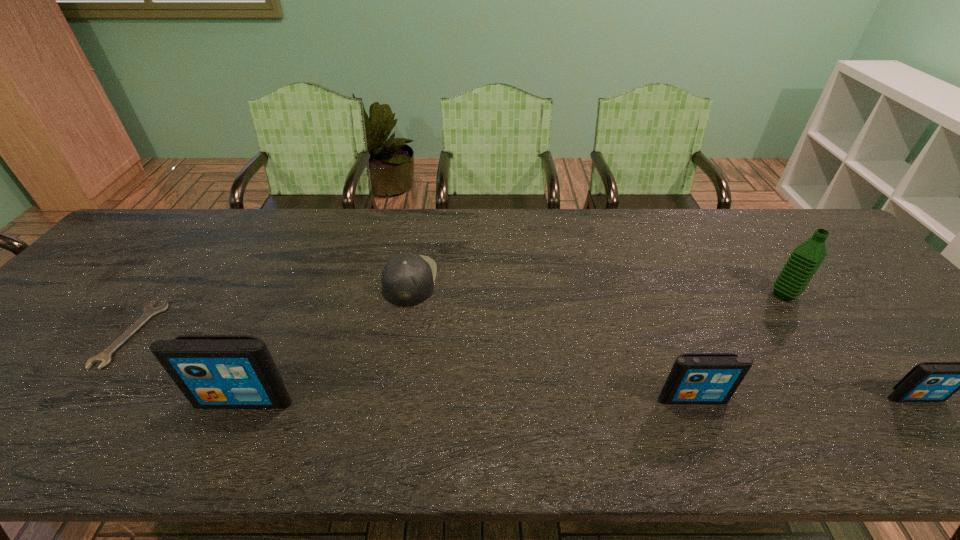
Locate an element on the screen. object identified as the third closest to the fifth object from right to left is located at coordinates (695, 378).

Where is `iPod identified as the closest to the fifth object from left to right`? iPod identified as the closest to the fifth object from left to right is located at coordinates (929, 381).

The width and height of the screenshot is (960, 540). What are the coordinates of `iPod that stands as the second closest to the fifth object from left to right` in the screenshot? It's located at (695, 378).

This screenshot has width=960, height=540. I want to click on blank space that satisfies the following two spatial constraints: 1. on the brim of the cap; 2. on the back side of the water bottle, so click(x=408, y=294).

The height and width of the screenshot is (540, 960). Identify the location of free space that satisfies the following two spatial constraints: 1. on the back side of the shortest object; 2. on the right side of the second object from right to left. (161, 294).

Find the location of a particular element. free space that satisfies the following two spatial constraints: 1. on the brim of the second shortest object; 2. on the right side of the water bottle is located at coordinates (408, 294).